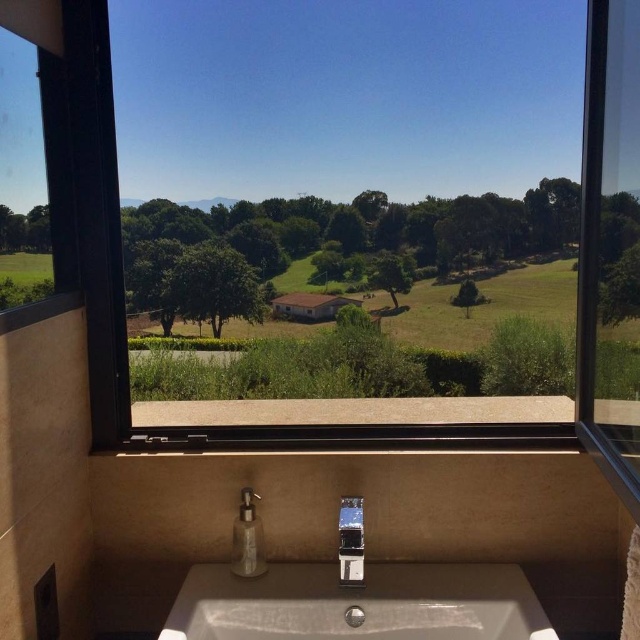
You are standing in the bathroom and want to look outside through the transparent glass window at upper left. Can you see the white ceramic sink at lower center blocking your view?

The transparent glass window at upper left is behind the white ceramic sink at lower center, so the sink is blocking your view of the window.

You are standing in the bathroom and want to know if you can see the outside view through the transparent glass window at center while washing your hands at the sink next to the satin nickel faucet at center. Can you see the window from that position?

Yes, the transparent glass window at center is taller than the satin nickel faucet at center, so you can see the window while washing your hands at the sink.

You are standing in the bathroom and want to look outside through the transparent glass window at center. Where should you position yourself to see the view outside?

The transparent glass window at center is located at point (371, 216), so you should position yourself at that point to see the view outside.